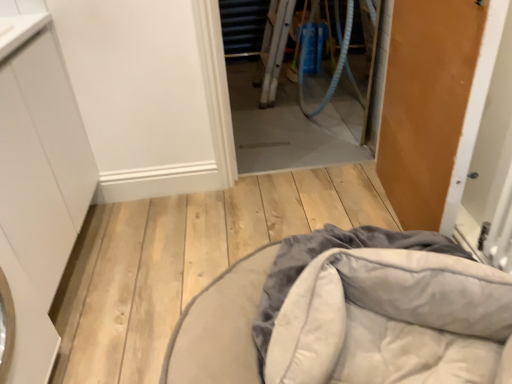
Question: Considering their positions, is velvet gray cushion at lower center located in front of or behind white matte cabinet at left?

Choices:
 (A) front
 (B) behind

Answer: (B)

Question: Is point (391, 253) closer or farther from the camera than point (76, 218)?

Choices:
 (A) farther
 (B) closer

Answer: (B)

Question: Based on their relative distances, which object is farther from the white matte cabinet at left?

Choices:
 (A) blue rubber garden hose at center
 (B) transparent plastic screen door at center
 (C) velvet gray cushion at lower center
 (D) wooden door at right

Answer: (A)

Question: Considering the real-world distances, which object is farthest from the wooden door at right?

Choices:
 (A) white matte cabinet at left
 (B) velvet gray cushion at lower center
 (C) transparent plastic screen door at center
 (D) blue rubber garden hose at center

Answer: (A)